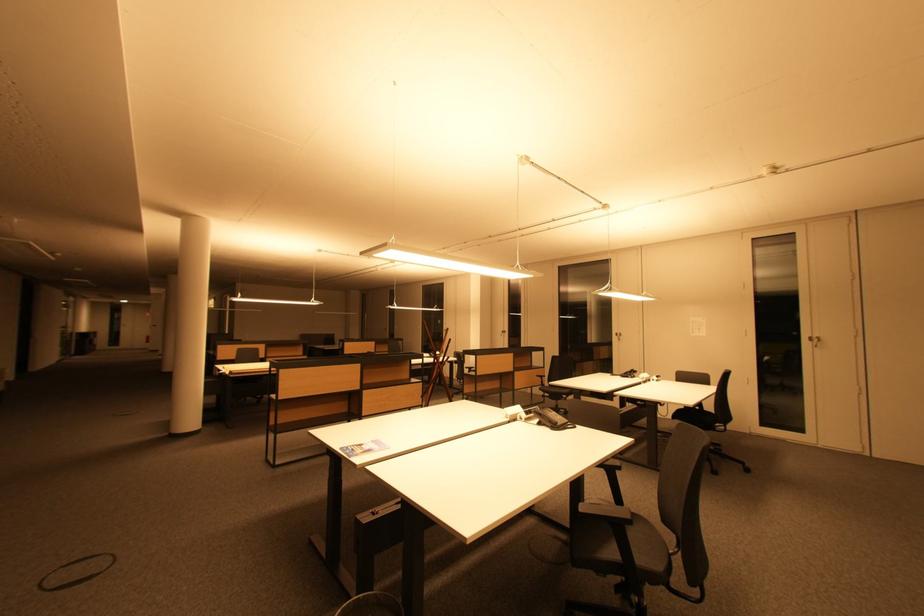
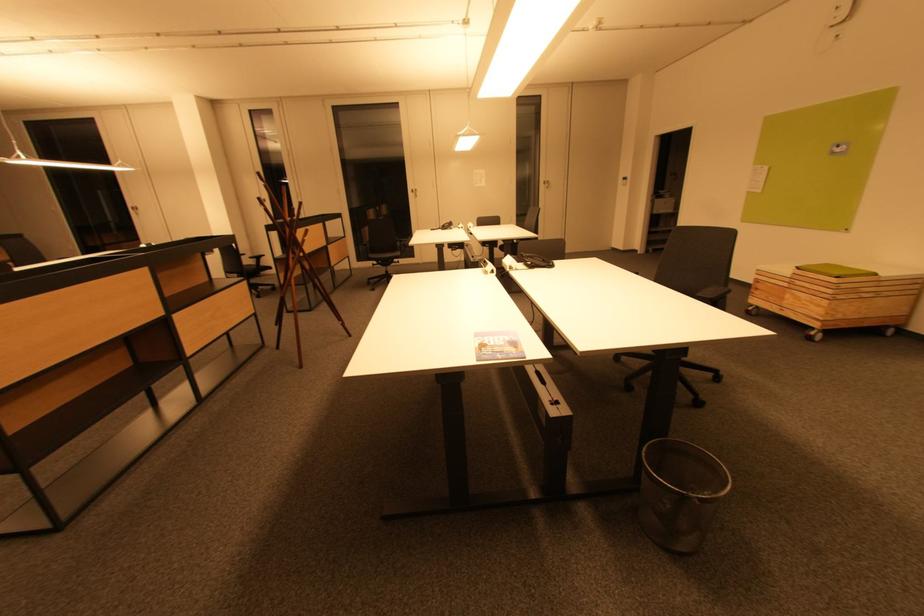
Locate, in the second image, the point that corresponds to point (625, 334) in the first image.

(419, 191)